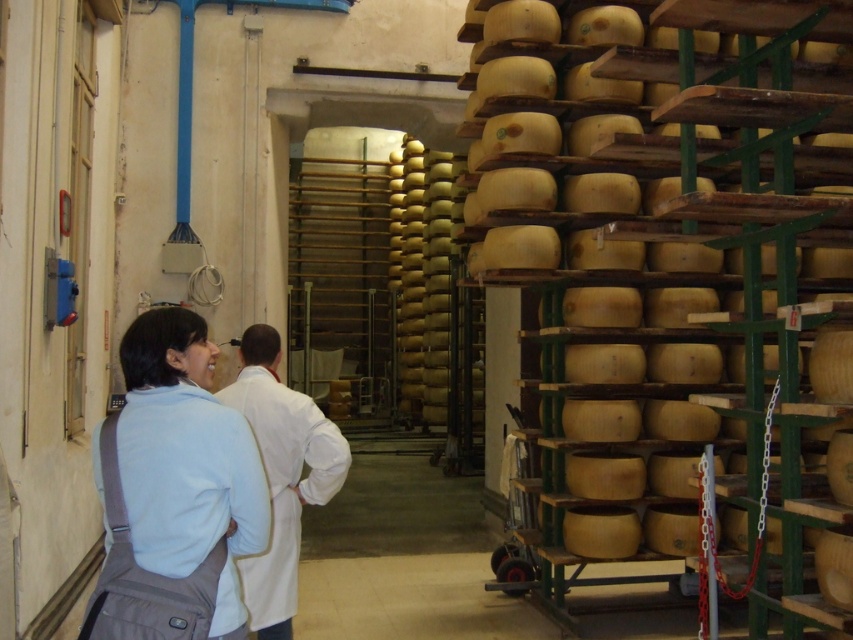
Who is taller, wooden cheese at center or white lab coat at center?

wooden cheese at center

Where is `wooden cheese at center`? wooden cheese at center is located at coordinates (688, 275).

Between point (724, 556) and point (311, 465), which one is positioned behind?

Positioned behind is point (724, 556).

Identify the location of wooden cheese at center. The height and width of the screenshot is (640, 853). (688, 275).

Does light blue fabric at center have a lesser height compared to white lab coat at center?

Yes, light blue fabric at center is shorter than white lab coat at center.

Who is higher up, light blue fabric at center or white lab coat at center?

light blue fabric at center is higher up.

Where is `light blue fabric at center`? light blue fabric at center is located at coordinates (173, 492).

Does wooden cheese at center appear on the right side of light blue fabric at center?

Correct, you'll find wooden cheese at center to the right of light blue fabric at center.

Is point (643, 416) farther from viewer compared to point (253, 525)?

Yes, it is.

This screenshot has height=640, width=853. I want to click on wooden cheese at center, so click(x=688, y=275).